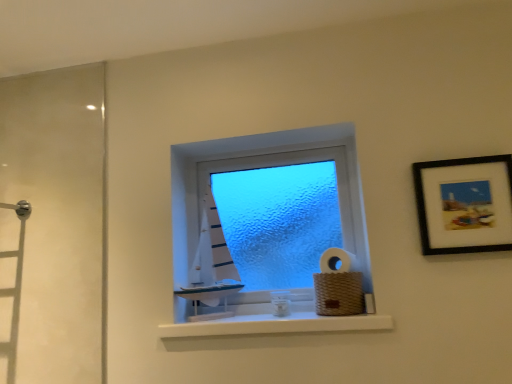
Question: Based on their positions, is white matte window sill at center located to the left or right of woven brown basket at lower right, which ranks as the 2th toilet paper in top-to-bottom order?

Choices:
 (A) right
 (B) left

Answer: (B)

Question: Relative to woven brown basket at lower right, which ranks as the 2th toilet paper in top-to-bottom order, is white matte window sill at center in front or behind?

Choices:
 (A) behind
 (B) front

Answer: (B)

Question: Estimate the real-world distances between objects in this image. Which object is closer to the white matte toilet paper at center, which is the second toilet paper in bottom-to-top order?

Choices:
 (A) black matte picture frame at upper right
 (B) white matte window sill at center
 (C) woven brown basket at lower right, which ranks as the 2th toilet paper in top-to-bottom order
 (D) blue frosted glass window at center
 (E) white matte sailboat at center

Answer: (C)

Question: Which object is the farthest from the white matte sailboat at center?

Choices:
 (A) white matte toilet paper at center, which ranks as the 1th toilet paper in top-to-bottom order
 (B) white matte window sill at center
 (C) black matte picture frame at upper right
 (D) woven brown basket at lower right, positioned as the first toilet paper in bottom-to-top order
 (E) blue frosted glass window at center

Answer: (C)